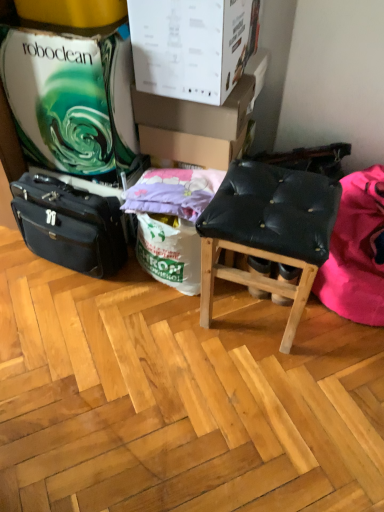
What is the approximate width of cardboard box at upper center, acting as the second cardboard box starting from the front?

The width of cardboard box at upper center, acting as the second cardboard box starting from the front, is 11.28 inches.

Describe the element at coordinates (196, 112) in the screenshot. I see `cardboard box at upper center, acting as the second cardboard box starting from the front` at that location.

What are the coordinates of `pink fabric at right` in the screenshot? It's located at (356, 251).

The height and width of the screenshot is (512, 384). Describe the element at coordinates (190, 147) in the screenshot. I see `cardboard box at upper center, placed as the 1th cardboard box when sorted from back to front` at that location.

Image resolution: width=384 pixels, height=512 pixels. What do you see at coordinates (69, 225) in the screenshot?
I see `black leather briefcase at left` at bounding box center [69, 225].

The width and height of the screenshot is (384, 512). I want to click on white cardboard box at upper center, placed as the third cardboard box when sorted from back to front, so click(192, 46).

Find the location of a particular element. cardboard box at upper center, acting as the second cardboard box starting from the front is located at coordinates (196, 112).

Considering the relative positions of pink fabric at right and cardboard box at upper center, which appears as the 2th cardboard box when viewed from the back, in the image provided, is pink fabric at right to the right of cardboard box at upper center, which appears as the 2th cardboard box when viewed from the back, from the viewer's perspective?

Indeed, pink fabric at right is positioned on the right side of cardboard box at upper center, which appears as the 2th cardboard box when viewed from the back.

Is pink fabric at right far away from cardboard box at upper center, acting as the second cardboard box starting from the front?

They are positioned close to each other.

This screenshot has height=512, width=384. What are the coordinates of `blanket that is under the cardboard box at upper center, which appears as the 2th cardboard box when viewed from the back (from a real-world perspective)` in the screenshot? It's located at (356, 251).

Considering the sizes of pink fabric at right and cardboard box at upper center, which appears as the 2th cardboard box when viewed from the back, in the image, is pink fabric at right wider or thinner than cardboard box at upper center, which appears as the 2th cardboard box when viewed from the back,?

pink fabric at right is wider than cardboard box at upper center, which appears as the 2th cardboard box when viewed from the back.

Considering the positions of objects cardboard box at upper center, placed as the 1th cardboard box when sorted from back to front, and pink fabric at right in the image provided, who is in front, cardboard box at upper center, placed as the 1th cardboard box when sorted from back to front, or pink fabric at right?

pink fabric at right is more forward.

From a real-world perspective, relative to pink fabric at right, is cardboard box at upper center, which is the third cardboard box in front-to-back order, vertically above or below?

From a real-world perspective, cardboard box at upper center, which is the third cardboard box in front-to-back order, is physically above pink fabric at right.

Is cardboard box at upper center, placed as the 1th cardboard box when sorted from back to front, positioned beyond the bounds of pink fabric at right?

Yes, cardboard box at upper center, placed as the 1th cardboard box when sorted from back to front, is located beyond the bounds of pink fabric at right.

Is cardboard box at upper center, which is the third cardboard box in front-to-back order, aimed at pink fabric at right?

No, cardboard box at upper center, which is the third cardboard box in front-to-back order, is not facing towards pink fabric at right.

Is white cardboard box at upper center, placed as the 1th cardboard box when sorted from front to back, to the right of black leather briefcase at left from the viewer's perspective?

Indeed, white cardboard box at upper center, placed as the 1th cardboard box when sorted from front to back, is positioned on the right side of black leather briefcase at left.

Locate an element on the screen. The width and height of the screenshot is (384, 512). the 1st cardboard box counting from the right side of the black leather briefcase at left is located at coordinates (192, 46).

Which is correct: white cardboard box at upper center, placed as the 1th cardboard box when sorted from front to back, is inside black leather briefcase at left, or outside of it?

white cardboard box at upper center, placed as the 1th cardboard box when sorted from front to back, cannot be found inside black leather briefcase at left.

Between white cardboard box at upper center, placed as the third cardboard box when sorted from back to front, and black leather briefcase at left, which one has larger size?

With larger size is black leather briefcase at left.

Consider the image. Considering the positions of objects black leather briefcase at left and cardboard box at upper center, placed as the 1th cardboard box when sorted from back to front, in the image provided, who is more to the left, black leather briefcase at left or cardboard box at upper center, placed as the 1th cardboard box when sorted from back to front,?

Positioned to the left is black leather briefcase at left.

In the scene shown: Can you see black leather briefcase at left touching cardboard box at upper center, which is the third cardboard box in front-to-back order?

No, black leather briefcase at left is not next to cardboard box at upper center, which is the third cardboard box in front-to-back order.

Is cardboard box at upper center, placed as the 1th cardboard box when sorted from back to front, at the back of black leather briefcase at left?

Yes, cardboard box at upper center, placed as the 1th cardboard box when sorted from back to front, is at the back of black leather briefcase at left.

From the image's perspective, is white cardboard box at upper center, placed as the third cardboard box when sorted from back to front, positioned above or below cardboard box at upper center, acting as the second cardboard box starting from the front?

Clearly, from the image's perspective, white cardboard box at upper center, placed as the third cardboard box when sorted from back to front, is above cardboard box at upper center, acting as the second cardboard box starting from the front.

Is white cardboard box at upper center, placed as the third cardboard box when sorted from back to front, facing away from cardboard box at upper center, acting as the second cardboard box starting from the front?

No, white cardboard box at upper center, placed as the third cardboard box when sorted from back to front,'s orientation is not away from cardboard box at upper center, acting as the second cardboard box starting from the front.

Considering the sizes of objects white cardboard box at upper center, placed as the 1th cardboard box when sorted from front to back, and cardboard box at upper center, which appears as the 2th cardboard box when viewed from the back, in the image provided, who is smaller, white cardboard box at upper center, placed as the 1th cardboard box when sorted from front to back, or cardboard box at upper center, which appears as the 2th cardboard box when viewed from the back,?

cardboard box at upper center, which appears as the 2th cardboard box when viewed from the back, is smaller.

The width and height of the screenshot is (384, 512). Find the location of `luggage and bags above the pink fabric at right (from the image's perspective)`. luggage and bags above the pink fabric at right (from the image's perspective) is located at coordinates (69, 225).

Is black leather briefcase at left bigger than pink fabric at right?

Actually, black leather briefcase at left might be smaller than pink fabric at right.

From a real-world perspective, is black leather briefcase at left positioned above or below pink fabric at right?

From a real-world perspective, black leather briefcase at left is physically below pink fabric at right.

Locate an element on the screen. stool on the right of white cardboard box at upper center, placed as the third cardboard box when sorted from back to front is located at coordinates (268, 231).

Who is more distant, white cardboard box at upper center, placed as the third cardboard box when sorted from back to front, or black leather stool at center?

white cardboard box at upper center, placed as the third cardboard box when sorted from back to front, is behind.

Consider the image. In the image, is white cardboard box at upper center, placed as the 1th cardboard box when sorted from front to back, on the left side or the right side of black leather stool at center?

From the image, it's evident that white cardboard box at upper center, placed as the 1th cardboard box when sorted from front to back, is to the left of black leather stool at center.

Where is `the 2nd cardboard box above when counting from the pink fabric at right (from the image's perspective)`? The image size is (384, 512). the 2nd cardboard box above when counting from the pink fabric at right (from the image's perspective) is located at coordinates (196, 112).

In order to click on blanket below the cardboard box at upper center, which is the third cardboard box in front-to-back order (from a real-world perspective) in this screenshot , I will do `click(356, 251)`.

Based on their spatial positions, is cardboard box at upper center, placed as the 1th cardboard box when sorted from back to front, or pink fabric at right closer to black leather stool at center?

Based on the image, pink fabric at right appears to be nearer to black leather stool at center.

Estimate the real-world distances between objects in this image. Which object is closer to cardboard box at upper center, which appears as the 2th cardboard box when viewed from the back, white cardboard box at upper center, placed as the 1th cardboard box when sorted from front to back, or black leather briefcase at left?

white cardboard box at upper center, placed as the 1th cardboard box when sorted from front to back, lies closer to cardboard box at upper center, which appears as the 2th cardboard box when viewed from the back, than the other object.

From the image, which object appears to be farther from black leather briefcase at left, cardboard box at upper center, which is the third cardboard box in front-to-back order, or pink fabric at right?

pink fabric at right is further to black leather briefcase at left.

Considering their positions, is black leather stool at center positioned further to pink fabric at right than cardboard box at upper center, which appears as the 2th cardboard box when viewed from the back?

Among the two, cardboard box at upper center, which appears as the 2th cardboard box when viewed from the back, is located further to pink fabric at right.

Considering their positions, is black leather stool at center positioned further to white cardboard box at upper center, placed as the third cardboard box when sorted from back to front, than black leather briefcase at left?

The object further to white cardboard box at upper center, placed as the third cardboard box when sorted from back to front, is black leather briefcase at left.

When comparing their distances from black leather briefcase at left, does black leather stool at center or cardboard box at upper center, which appears as the 2th cardboard box when viewed from the back, seem closer?

Based on the image, cardboard box at upper center, which appears as the 2th cardboard box when viewed from the back, appears to be nearer to black leather briefcase at left.

Which object lies further to the anchor point pink fabric at right, black leather stool at center or black leather briefcase at left?

black leather briefcase at left is further to pink fabric at right.

Based on their spatial positions, is cardboard box at upper center, placed as the 1th cardboard box when sorted from back to front, or white cardboard box at upper center, placed as the third cardboard box when sorted from back to front, closer to cardboard box at upper center, acting as the second cardboard box starting from the front?

cardboard box at upper center, placed as the 1th cardboard box when sorted from back to front, is positioned closer to the anchor cardboard box at upper center, acting as the second cardboard box starting from the front.

Identify the location of cardboard box located between white cardboard box at upper center, placed as the third cardboard box when sorted from back to front, and cardboard box at upper center, which is the third cardboard box in front-to-back order, in the depth direction. Image resolution: width=384 pixels, height=512 pixels. (196, 112).

At what (x,y) coordinates should I click in order to perform the action: click on pillow that lies between cardboard box at upper center, which is the third cardboard box in front-to-back order, and black leather stool at center from top to bottom. Please return your answer as a coordinate pair (x, y). The width and height of the screenshot is (384, 512). Looking at the image, I should click on (173, 192).

I want to click on cardboard box situated between black leather briefcase at left and cardboard box at upper center, placed as the 1th cardboard box when sorted from back to front, from left to right, so click(x=192, y=46).

The width and height of the screenshot is (384, 512). I want to click on pillow between black leather briefcase at left and cardboard box at upper center, which is the third cardboard box in front-to-back order, so click(x=173, y=192).